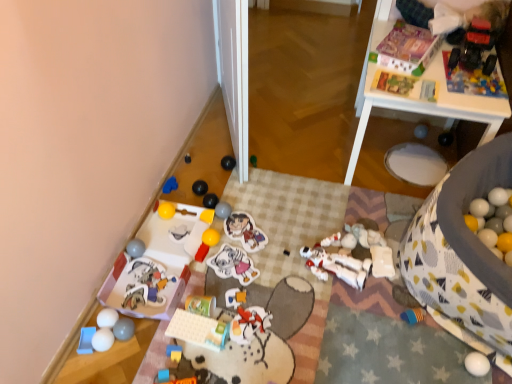
This screenshot has width=512, height=384. I want to click on empty space that is in between rubber yellow block at lower center, marked as the eleventh toy in a left-to-right arrangement, and rubber ball at center, the tenth toy when ordered from right to left, so click(203, 274).